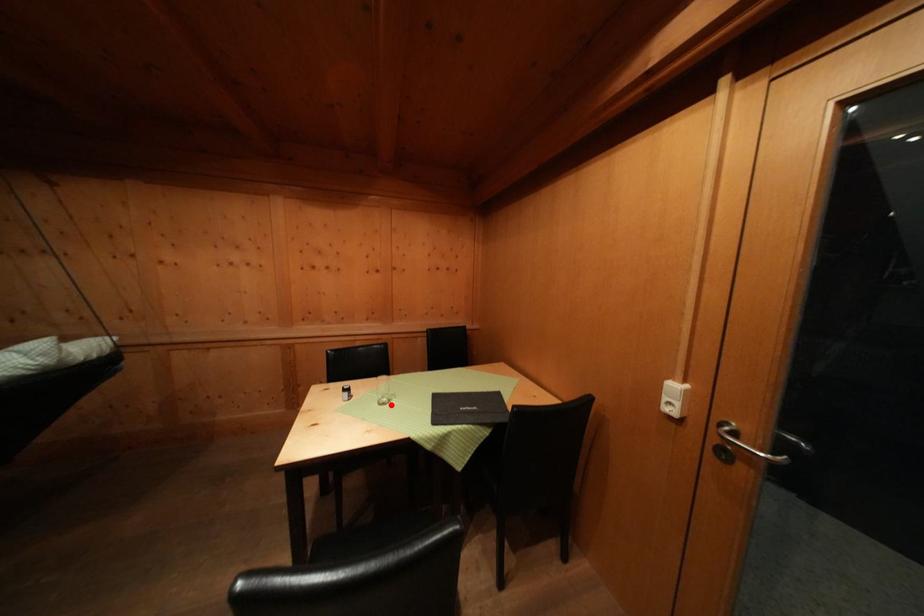
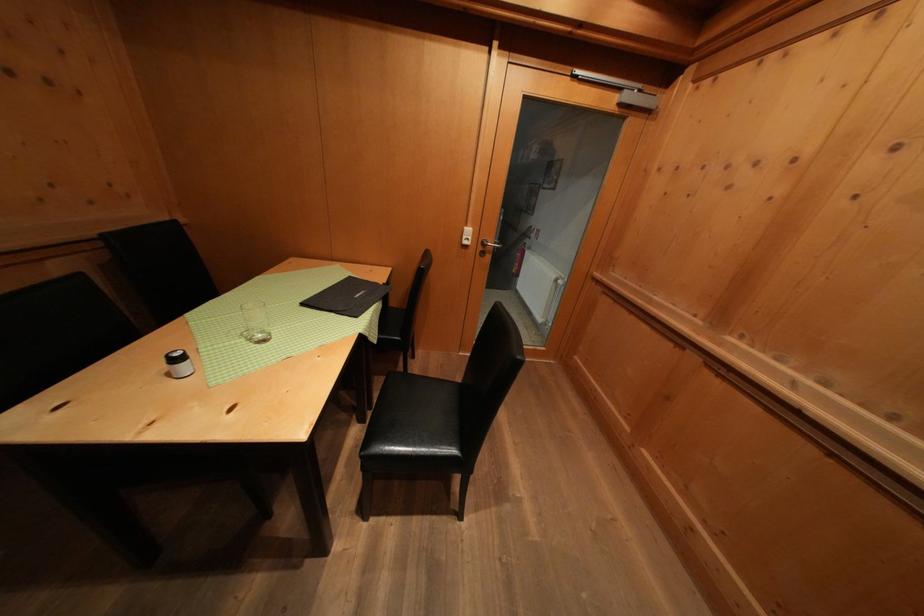
The point at the highlighted location is marked in the first image. Where is the corresponding point in the second image?

(264, 341)